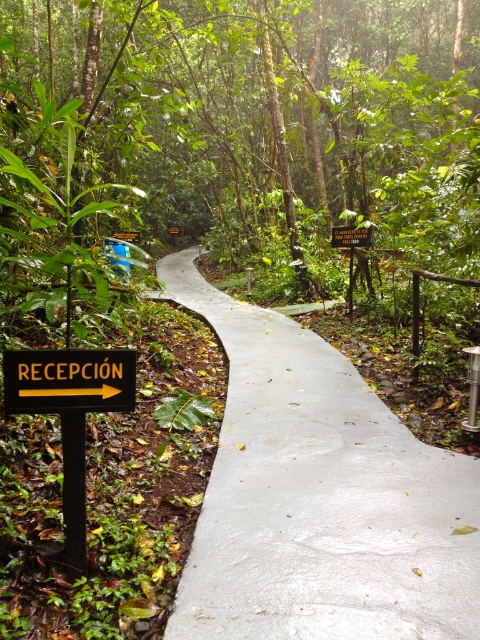
Who is lower down, white concrete path at center or yellowmaterial/texturesign at left?

white concrete path at center is lower down.

Is point (290, 541) less distant than point (12, 355)?

No, (290, 541) is further to viewer.

Which is in front, point (290, 627) or point (24, 372)?

Point (290, 627) is in front.

Find the location of a particular element. white concrete path at center is located at coordinates (319, 497).

Between yellowmaterial/texturesign at left and wooden sign at center, which one has less height?

yellowmaterial/texturesign at left is shorter.

Can you confirm if yellowmaterial/texturesign at left is smaller than wooden sign at center?

Indeed, yellowmaterial/texturesign at left has a smaller size compared to wooden sign at center.

Where is `yellowmaterial/texturesign at left`? yellowmaterial/texturesign at left is located at coordinates (69, 380).

I want to click on yellowmaterial/texturesign at left, so click(x=69, y=380).

Does white concrete path at center have a larger size compared to wooden sign at center?

Correct, white concrete path at center is larger in size than wooden sign at center.

Between white concrete path at center and wooden sign at center, which one is positioned lower?

Positioned lower is white concrete path at center.

Measure the distance between white concrete path at center and camera.

white concrete path at center and camera are 2.25 meters apart.

You are a GUI agent. You are given a task and a screenshot of the screen. Output one action in this format:
    pyautogui.click(x=<x>, y=<y>)
    Task: Click on the white concrete path at center
    
    Given the screenshot: What is the action you would take?
    pyautogui.click(x=319, y=497)